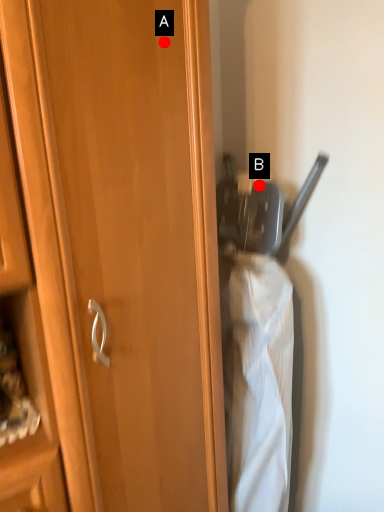
Question: Two points are circled on the image, labeled by A and B beside each circle. Which point is closer to the camera taking this photo?

Choices:
 (A) A is closer
 (B) B is closer

Answer: (A)